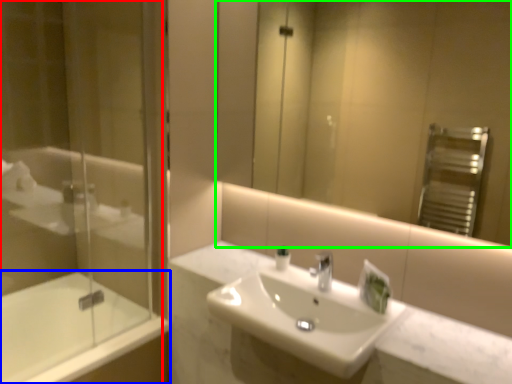
Question: Which object is the farthest from shower door (highlighted by a red box)? Choose among these: bathtub (highlighted by a blue box) or mirror (highlighted by a green box).

Choices:
 (A) bathtub
 (B) mirror

Answer: (B)